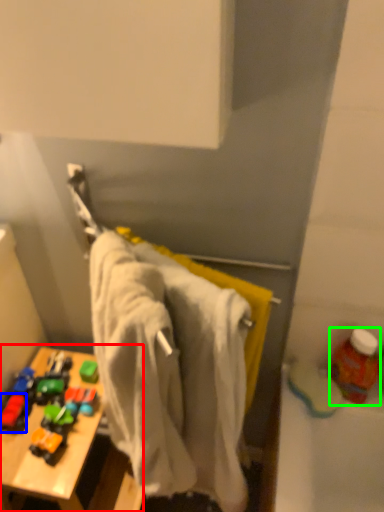
Question: Which is farther away from table (highlighted by a red box)? toy (highlighted by a blue box) or bottle (highlighted by a green box)?

Choices:
 (A) toy
 (B) bottle

Answer: (B)